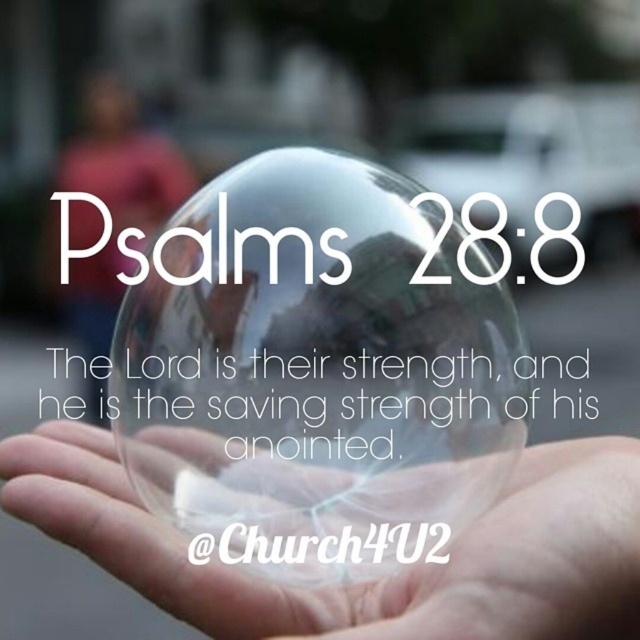
You are a photographer trying to capture the point at coordinates point [344,321] in focus. Given that your camera has a depth of field that can sharply focus objects within 18 centimeters from the lens, will the point be in focus?

The point [344,321] is 20.67 centimeters from the camera, which is beyond the 18 centimeter depth of field range. Therefore, the point will not be in focus.

You are a photographer trying to capture the reflection in the transparent glass sphere at center. Given that your camera lens is 2.5 inches in diameter, will the sphere reflect the entire lens in its surface?

The transparent glass sphere at center and camera are 7.92 inches apart from each other. Since the distance between them is greater than the camera lens diameter of 2.5 inches, the sphere can reflect the entire lens in its surface.

You are a photographer trying to capture the reflection in the transparent glass bubble at center. Since the matte pink shirt at upper left is visible in the reflection, does the shirt need to be in the same position relative to the bubble as it is in the real scene?

Yes, because the transparent glass bubble at center is in front of the matte pink shirt at upper left, the reflection in the bubble will show the shirt in the same position as it is in reality.